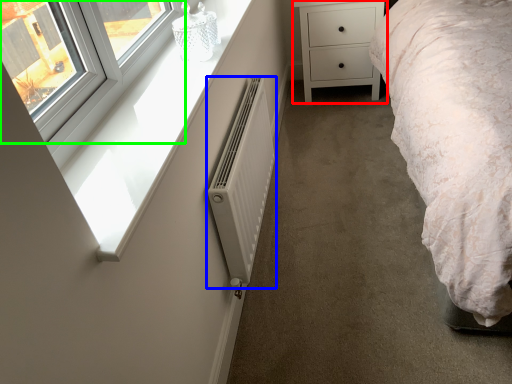
Question: Which is nearer to the chest of drawers (highlighted by a red box)? radiator (highlighted by a blue box) or window (highlighted by a green box).

Choices:
 (A) radiator
 (B) window

Answer: (A)